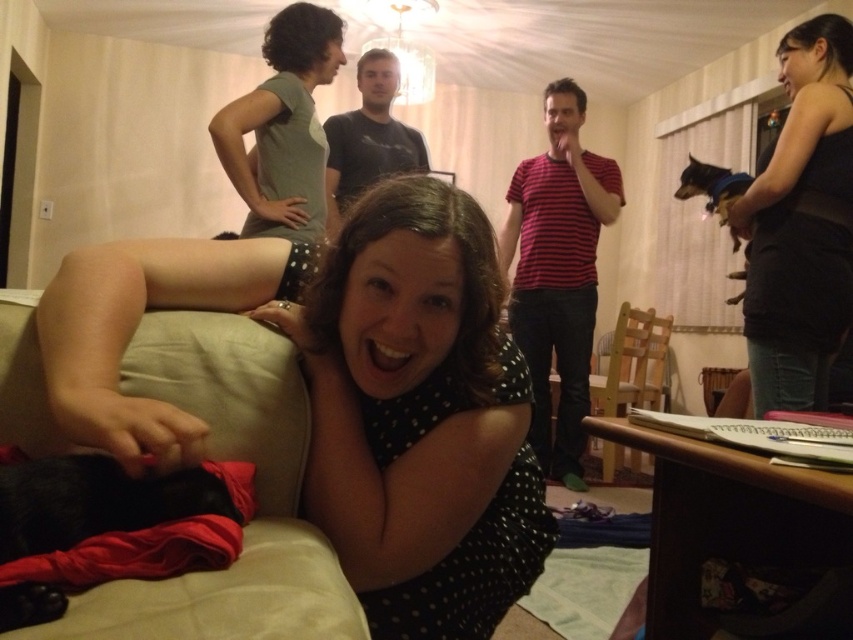
Question: Which point is farther to the camera?

Choices:
 (A) black tank top at upper right
 (B) beige fabric couch at lower left
 (C) black cotton shirt at center
 (D) striped cotton shirt at center

Answer: (D)

Question: Is black dotted dress at center thinner than black tank top at upper right?

Choices:
 (A) yes
 (B) no

Answer: (B)

Question: Is beige fabric couch at lower left below black tank top at upper right?

Choices:
 (A) no
 (B) yes

Answer: (B)

Question: Is black tank top at upper right wider than striped cotton shirt at center?

Choices:
 (A) no
 (B) yes

Answer: (A)

Question: Which object appears farthest from the camera in this image?

Choices:
 (A) black dotted dress at center
 (B) black tank top at upper right
 (C) black cotton shirt at center

Answer: (C)

Question: Which is nearer to the black dotted dress at center?

Choices:
 (A) black cotton shirt at center
 (B) striped cotton shirt at center

Answer: (A)